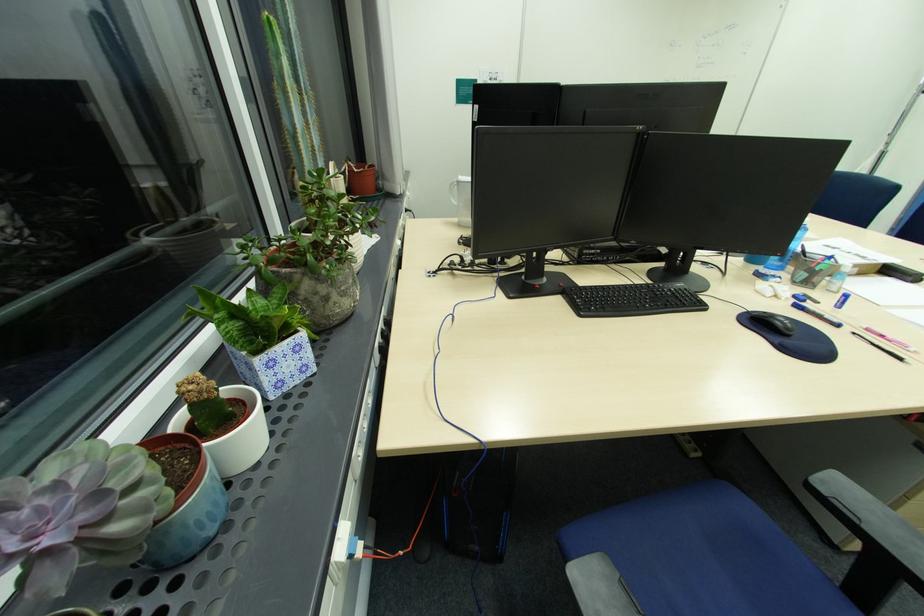
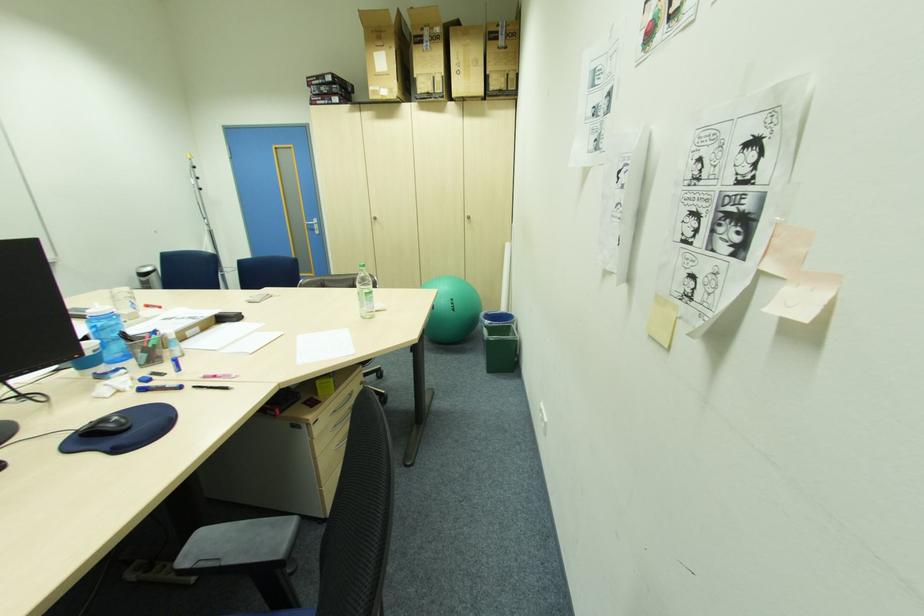
Question: The images are taken continuously from a first-person perspective. In which direction is your viewpoint rotating?

Choices:
 (A) Left
 (B) Right
 (C) Up
 (D) Down

Answer: (B)